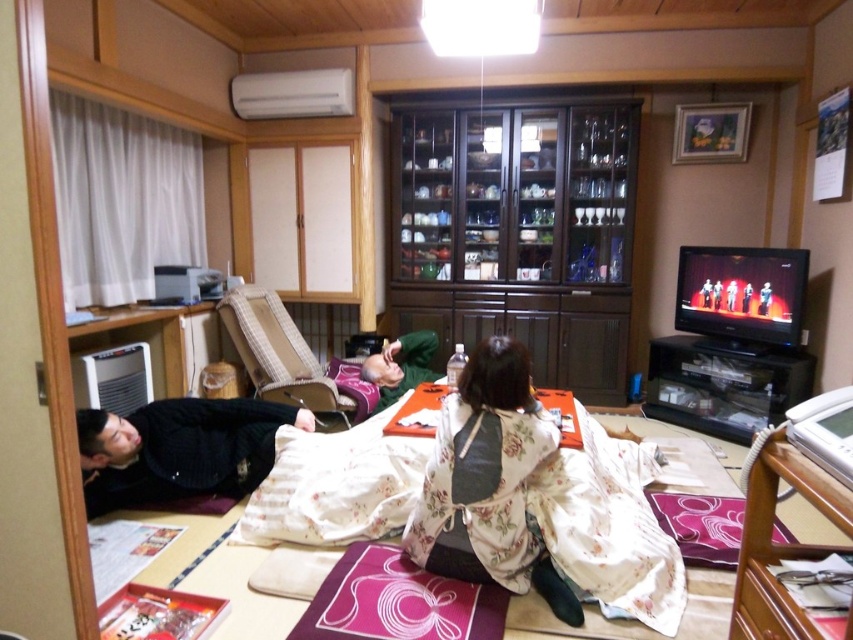
Question: Based on their relative distances, which object is farther from the green matte kimono at center?

Choices:
 (A) black sweater at lower left
 (B) dark wood cabinet at center
 (C) floral silk kimono at center

Answer: (C)

Question: Which point is farther to the camera?

Choices:
 (A) dark wood cabinet at center
 (B) green matte kimono at center

Answer: (A)

Question: Does dark wood cabinet at center appear under black sweater at lower left?

Choices:
 (A) no
 (B) yes

Answer: (A)

Question: Which is farther from the green matte kimono at center?

Choices:
 (A) dark wood cabinet at center
 (B) floral silk kimono at center

Answer: (B)

Question: Does dark wood cabinet at center have a lesser width compared to black sweater at lower left?

Choices:
 (A) yes
 (B) no

Answer: (B)

Question: Can you confirm if dark wood cabinet at center is positioned above green matte kimono at center?

Choices:
 (A) no
 (B) yes

Answer: (B)